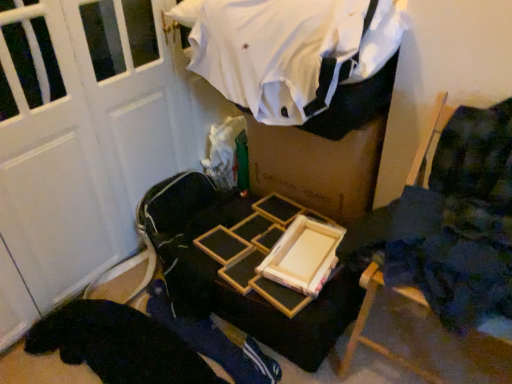
This screenshot has height=384, width=512. I want to click on free region under wooden chair at right (from a real-world perspective), so click(x=420, y=355).